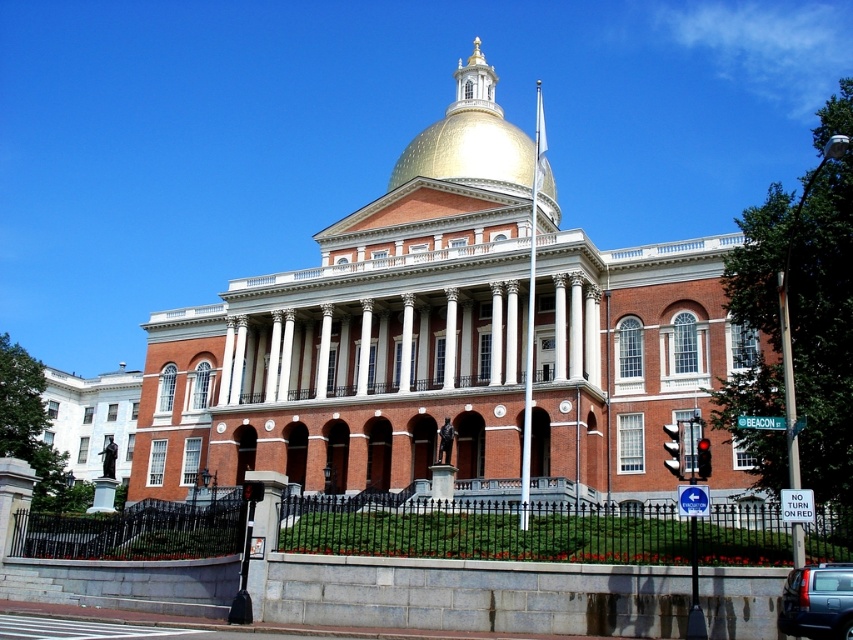
Which is above, gold polished dome at center or metallic gray sedan at lower right?

gold polished dome at center

Does gold polished dome at center appear over metallic gray sedan at lower right?

Correct, gold polished dome at center is located above metallic gray sedan at lower right.

Does point (489, 145) come in front of point (840, 636)?

No, (489, 145) is further to viewer.

Find the location of a particular element. gold polished dome at center is located at coordinates (469, 138).

Does gold polished dome at center have a greater width compared to green metallic street sign at center?

Yes.

Does gold polished dome at center have a larger size compared to green metallic street sign at center?

Correct, gold polished dome at center is larger in size than green metallic street sign at center.

This screenshot has height=640, width=853. What do you see at coordinates (469, 138) in the screenshot?
I see `gold polished dome at center` at bounding box center [469, 138].

Where is `gold polished dome at center`? The width and height of the screenshot is (853, 640). gold polished dome at center is located at coordinates (469, 138).

Does metallic gray sedan at lower right have a lesser height compared to green metallic street sign at center?

In fact, metallic gray sedan at lower right may be taller than green metallic street sign at center.

Does metallic gray sedan at lower right have a greater width compared to green metallic street sign at center?

Yes, metallic gray sedan at lower right is wider than green metallic street sign at center.

Is point (822, 572) closer to viewer compared to point (744, 422)?

Yes, point (822, 572) is in front of point (744, 422).

Identify the location of metallic gray sedan at lower right. The width and height of the screenshot is (853, 640). (817, 600).